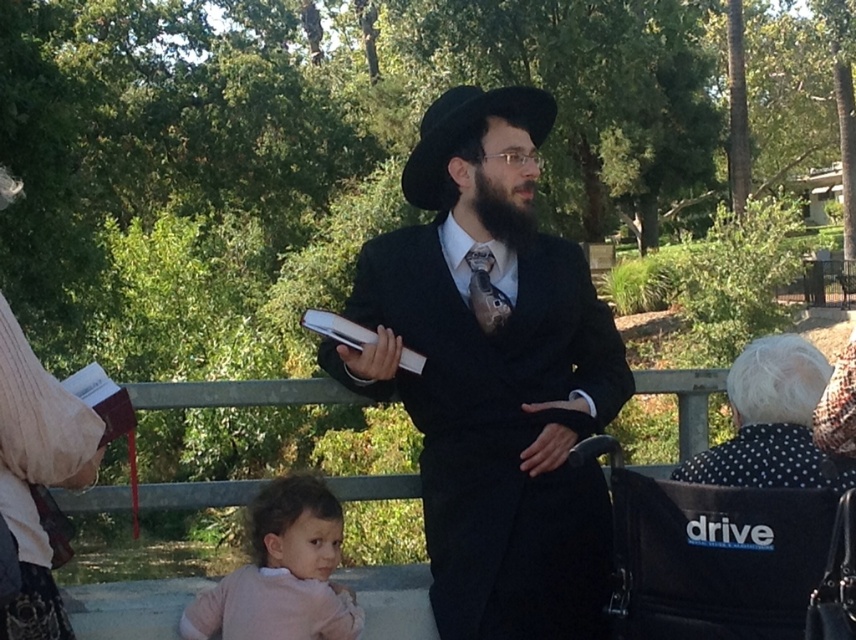
You are a photographer trying to capture the scene with the man and the child. You want to ensure both the pink soft fabric at lower left and the black dotted dress at lower right are clearly visible in your shot. Based on their positions, which one should you focus on first to ensure proper framing?

The pink soft fabric at lower left is positioned on the left side of black dotted dress at lower right, so you should focus on the pink soft fabric at lower left first to ensure proper framing as it is on the left side and closer to the edge of the frame.

You are standing at the point with coordinates point (524, 154) and want to walk towards the point (476, 188). Which direction should you move?

Since point (524, 154) is in front of point (476, 188), you should move backward to reach point (476, 188).

You are a photographer trying to capture a candid shot of the two subjects in the scene. The pink soft fabric at lower left and the black dotted dress at lower right are both in your viewfinder. Which subject should you focus on if you want to prioritize the one that is taller?

The pink soft fabric at lower left is much taller than the black dotted dress at lower right, so you should focus on the pink soft fabric at lower left.